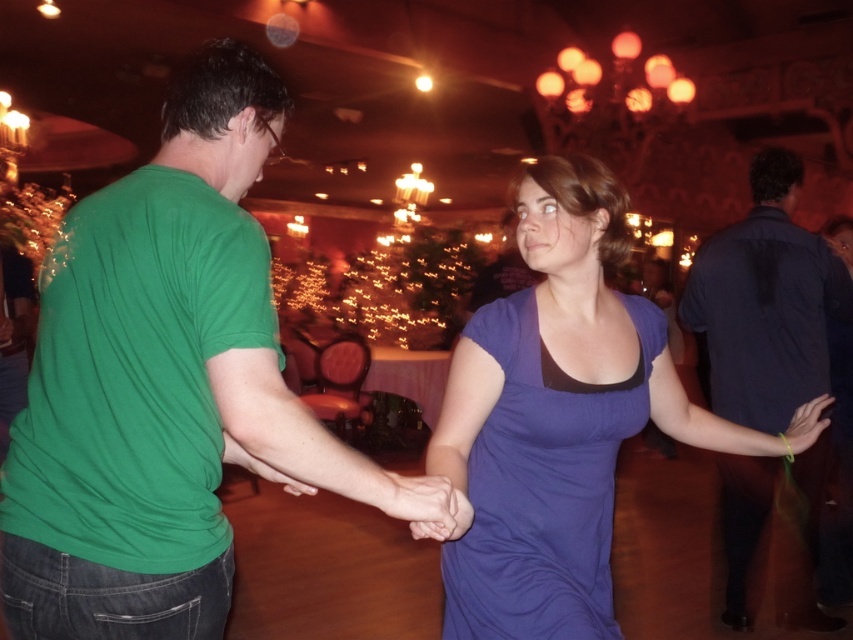
Between green cotton t-shirt at center and dark blue shirt at right, which one has more height?

With more height is dark blue shirt at right.

Does green cotton t-shirt at center have a smaller size compared to dark blue shirt at right?

Indeed, green cotton t-shirt at center has a smaller size compared to dark blue shirt at right.

Does point (238, 188) come in front of point (747, 532)?

Yes, it is.

Locate an element on the screen. green cotton t-shirt at center is located at coordinates (166, 385).

Between purple soft fabric dress at center and dark blue shirt at right, which one is positioned higher?

Positioned higher is dark blue shirt at right.

Does point (582, 566) come closer to viewer compared to point (824, 356)?

Yes, it is in front of point (824, 356).

You are a GUI agent. You are given a task and a screenshot of the screen. Output one action in this format:
    pyautogui.click(x=<x>, y=<y>)
    Task: Click on the purple soft fabric dress at center
    This screenshot has height=640, width=853.
    Given the screenshot: What is the action you would take?
    pyautogui.click(x=543, y=484)

Does point (578, 212) lie behind point (775, 429)?

That is False.

At what (x,y) coordinates should I click in order to perform the action: click on purple satin dress at center. Please return your answer as a coordinate pair (x, y). This screenshot has height=640, width=853. Looking at the image, I should click on (560, 419).

Locate an element on the screen. purple satin dress at center is located at coordinates (560, 419).